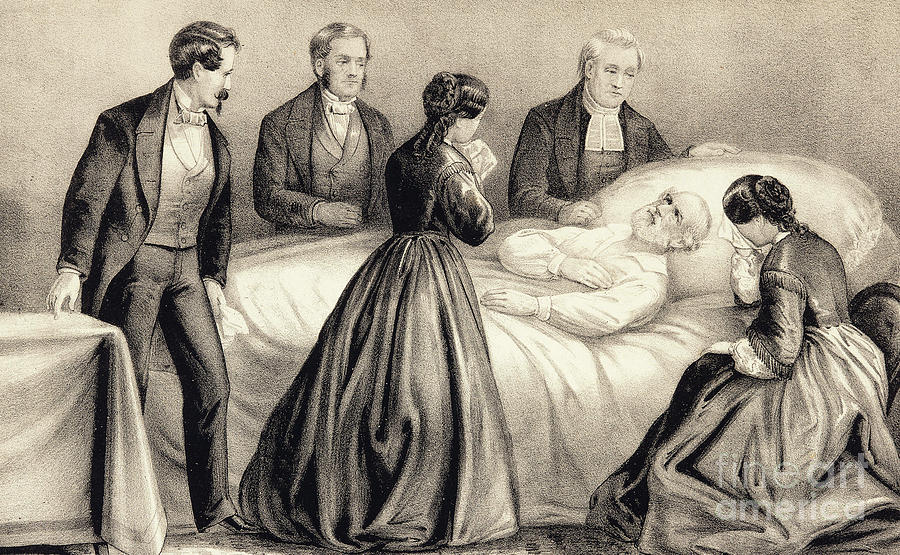
The image size is (900, 555). I want to click on half rectangular table with long silky cloth, so click(56, 363).